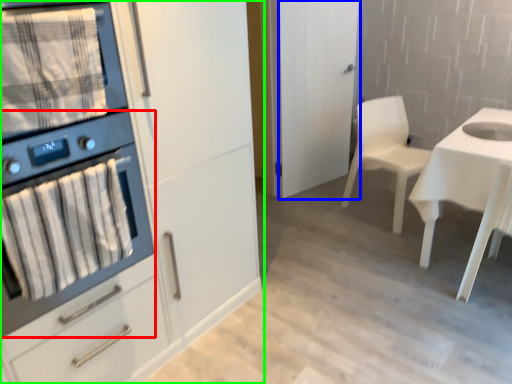
Question: Which is farther away from kitchen appliance (highlighted by a red box)? glass door (highlighted by a blue box) or cabinetry (highlighted by a green box)?

Choices:
 (A) glass door
 (B) cabinetry

Answer: (A)